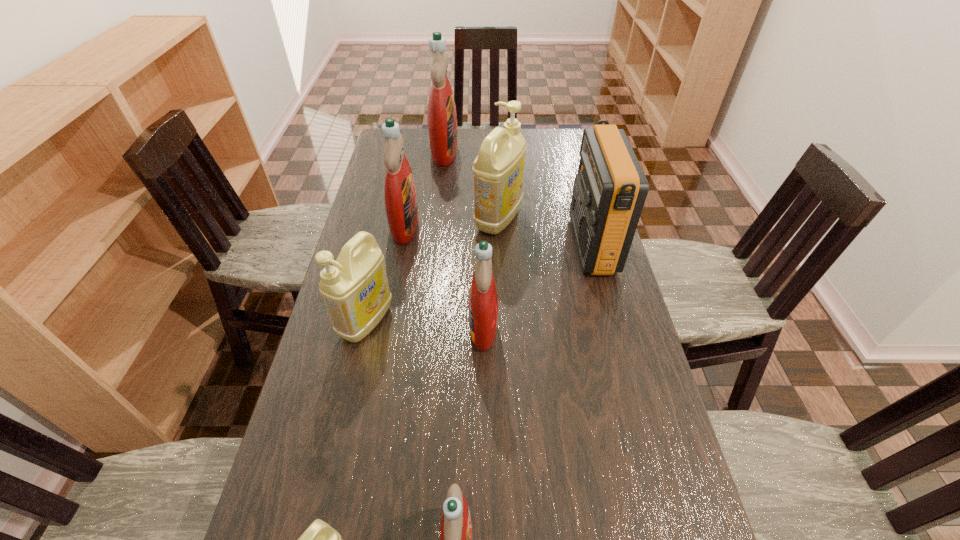
Locate an element on the screen. the farthest object is located at coordinates (442, 120).

Locate an element on the screen. the farthest detergent is located at coordinates (442, 120).

Identify the location of the rightmost beige detergent. (498, 171).

Identify the location of the farthest beige detergent. coord(498,171).

Locate an element on the screen. The image size is (960, 540). the second biggest red detergent is located at coordinates (401, 204).

Where is `the rightmost object`? The image size is (960, 540). the rightmost object is located at coordinates (610, 189).

Find the location of a particular element. Image resolution: width=960 pixels, height=540 pixels. the second nearest red detergent is located at coordinates (483, 301).

Where is `the second biggest beige detergent`? the second biggest beige detergent is located at coordinates (355, 289).

Locate an element on the screen. The image size is (960, 540). free space located 0.080m on the front surface of the biggest red detergent is located at coordinates (478, 152).

Identify the location of free spot located 0.200m on the left of the rightmost beige detergent. (415, 219).